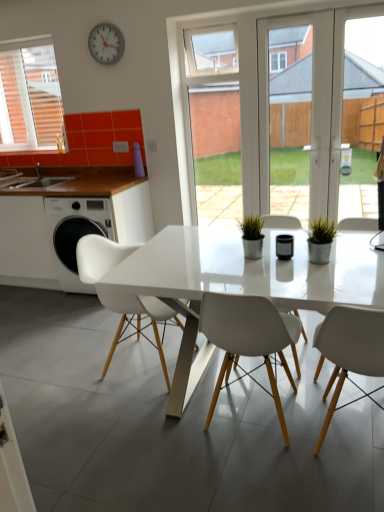
Question: Is there a large distance between white plastic chair at left and black glossy pen holder at center?

Choices:
 (A) no
 (B) yes

Answer: (B)

Question: Does white plastic chair at left appear on the left side of black glossy pen holder at center?

Choices:
 (A) no
 (B) yes

Answer: (B)

Question: Considering the relative sizes of white plastic chair at left and black glossy pen holder at center in the image provided, is white plastic chair at left thinner than black glossy pen holder at center?

Choices:
 (A) yes
 (B) no

Answer: (B)

Question: Could you tell me if white plastic chair at left is facing black glossy pen holder at center?

Choices:
 (A) yes
 (B) no

Answer: (B)

Question: Is white plastic chair at left positioned before black glossy pen holder at center?

Choices:
 (A) yes
 (B) no

Answer: (B)

Question: From the image's perspective, is green matte plant at right above or below metallic gray clock at upper center?

Choices:
 (A) below
 (B) above

Answer: (A)

Question: Considering their positions, is green matte plant at right located in front of or behind metallic gray clock at upper center?

Choices:
 (A) front
 (B) behind

Answer: (A)

Question: From a real-world perspective, is green matte plant at right above or below metallic gray clock at upper center?

Choices:
 (A) above
 (B) below

Answer: (B)

Question: Is green matte plant at right inside the boundaries of metallic gray clock at upper center, or outside?

Choices:
 (A) inside
 (B) outside

Answer: (B)

Question: Considering the positions of white plastic chair at left and green matte plant at right in the image, is white plastic chair at left bigger or smaller than green matte plant at right?

Choices:
 (A) small
 (B) big

Answer: (B)

Question: From the image's perspective, is white plastic chair at left located above or below green matte plant at right?

Choices:
 (A) below
 (B) above

Answer: (B)

Question: Is point (31, 272) positioned closer to the camera than point (334, 231)?

Choices:
 (A) farther
 (B) closer

Answer: (A)

Question: Considering their positions, is white plastic chair at left located in front of or behind green matte plant at right?

Choices:
 (A) front
 (B) behind

Answer: (B)

Question: From their relative heights in the image, would you say white matte chair at left, which is the third chair in right-to-left order, is taller or shorter than transparent glass door at center?

Choices:
 (A) tall
 (B) short

Answer: (B)

Question: Does point (115, 342) appear closer or farther from the camera than point (327, 145)?

Choices:
 (A) farther
 (B) closer

Answer: (B)